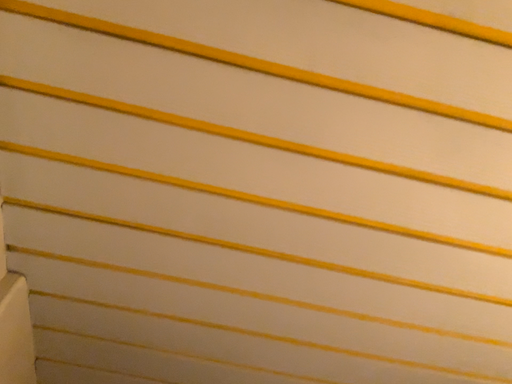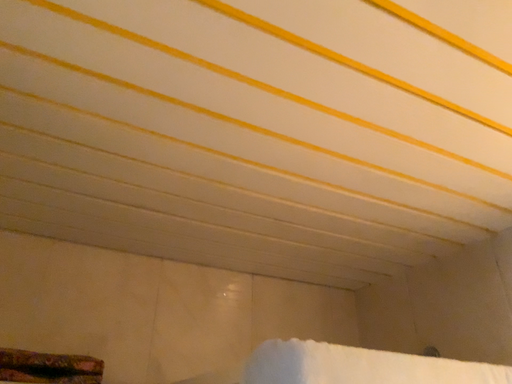
Question: Which way did the camera rotate in the video?

Choices:
 (A) rotated right
 (B) rotated left

Answer: (A)